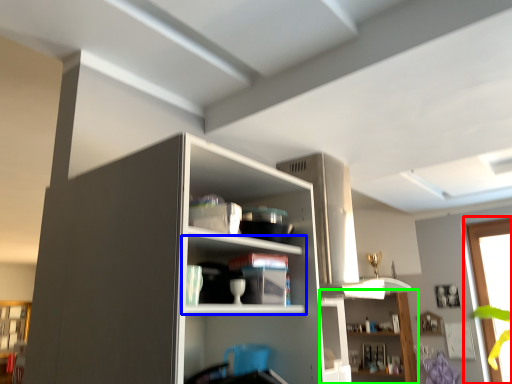
Question: Which object is the farthest from window (highlighted by a red box)? Choose among these: shelf (highlighted by a blue box) or shelf (highlighted by a green box).

Choices:
 (A) shelf
 (B) shelf

Answer: (A)